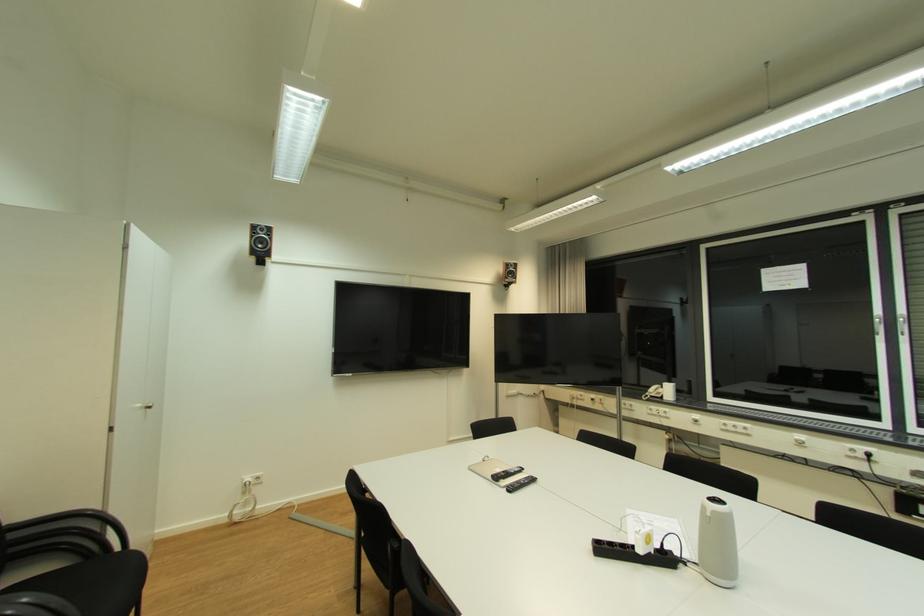
Where would you press the power strip switch? Please return your answer as a coordinate pair (x, y).

(251, 480)